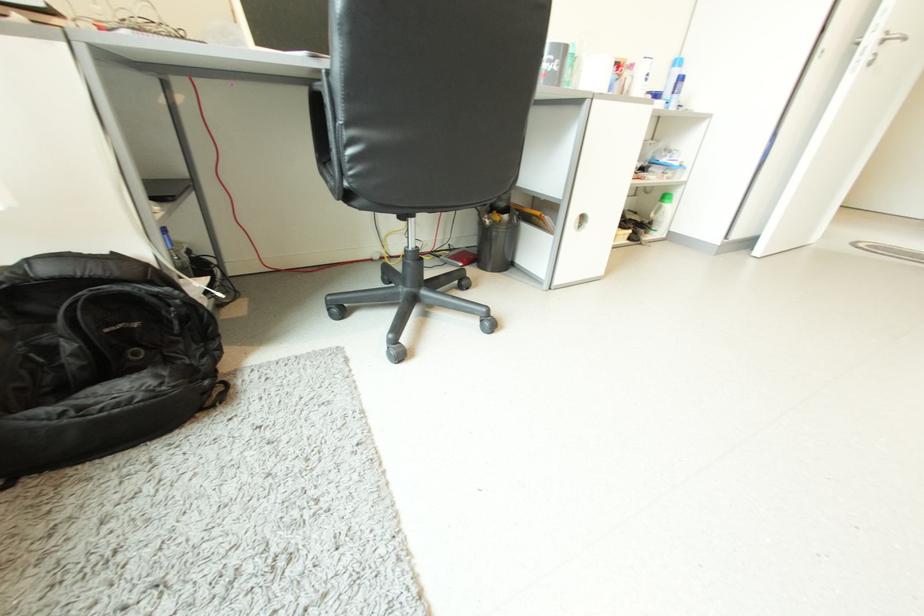
Where is `blue water bottle`? blue water bottle is located at coordinates [672, 77].